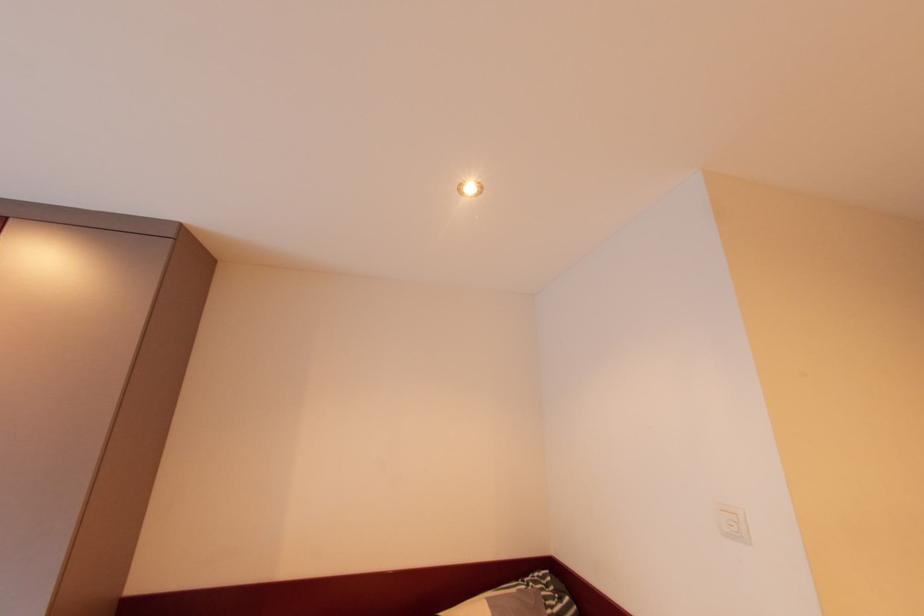
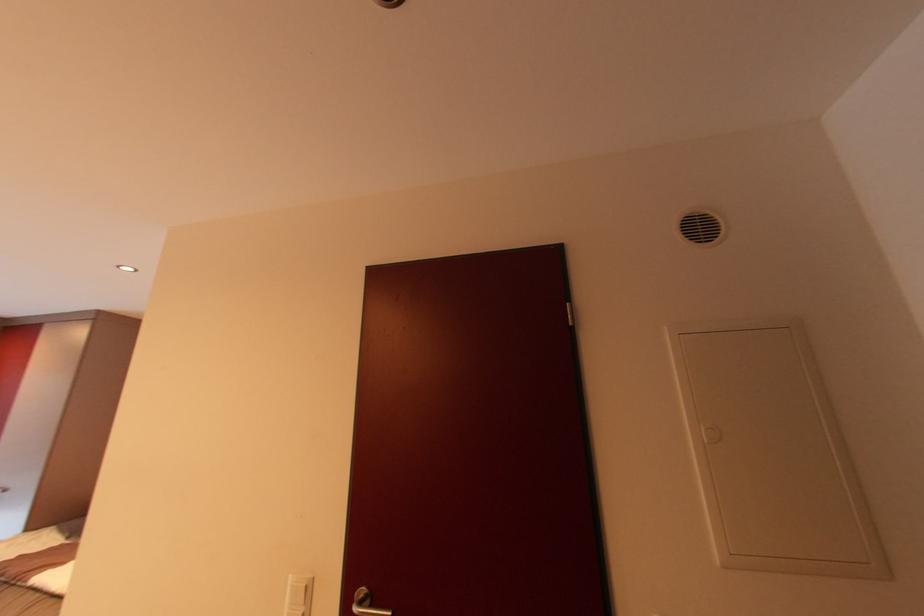
Question: In a continuous first-person perspective shot, in which direction is the camera moving?

Choices:
 (A) Left
 (B) Right
 (C) Forward
 (D) Backward

Answer: (B)